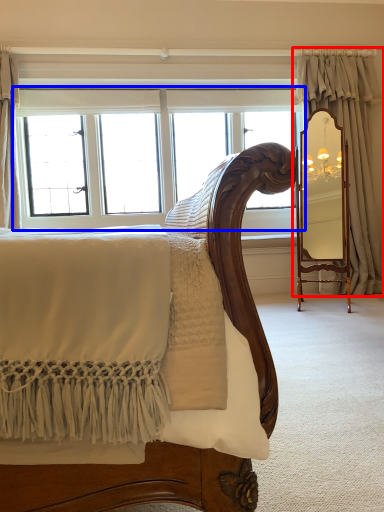
Question: Which object is further to the camera taking this photo, curtain (highlighted by a red box) or window (highlighted by a blue box)?

Choices:
 (A) curtain
 (B) window

Answer: (B)